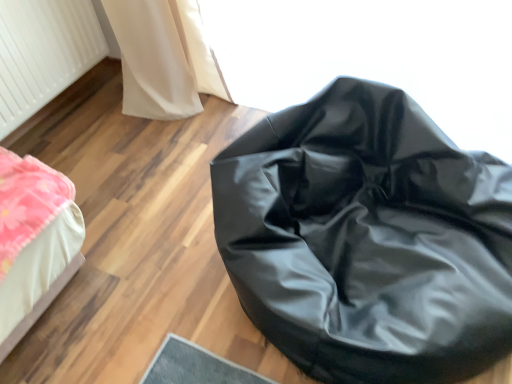
Question: Considering the positions of white textured radiator at upper left and black leather bean bag at center in the image, is white textured radiator at upper left wider or thinner than black leather bean bag at center?

Choices:
 (A) wide
 (B) thin

Answer: (B)

Question: Based on their sizes in the image, would you say white textured radiator at upper left is bigger or smaller than black leather bean bag at center?

Choices:
 (A) small
 (B) big

Answer: (A)

Question: Do you think white textured radiator at upper left is within black leather bean bag at center, or outside of it?

Choices:
 (A) inside
 (B) outside

Answer: (B)

Question: In terms of width, does black leather bean bag at center look wider or thinner when compared to white textured radiator at upper left?

Choices:
 (A) thin
 (B) wide

Answer: (B)

Question: Based on their positions, is black leather bean bag at center located to the left or right of white textured radiator at upper left?

Choices:
 (A) left
 (B) right

Answer: (B)

Question: Is black leather bean bag at center situated inside white textured radiator at upper left or outside?

Choices:
 (A) inside
 (B) outside

Answer: (B)

Question: Is black leather bean bag at center taller or shorter than white textured radiator at upper left?

Choices:
 (A) short
 (B) tall

Answer: (B)